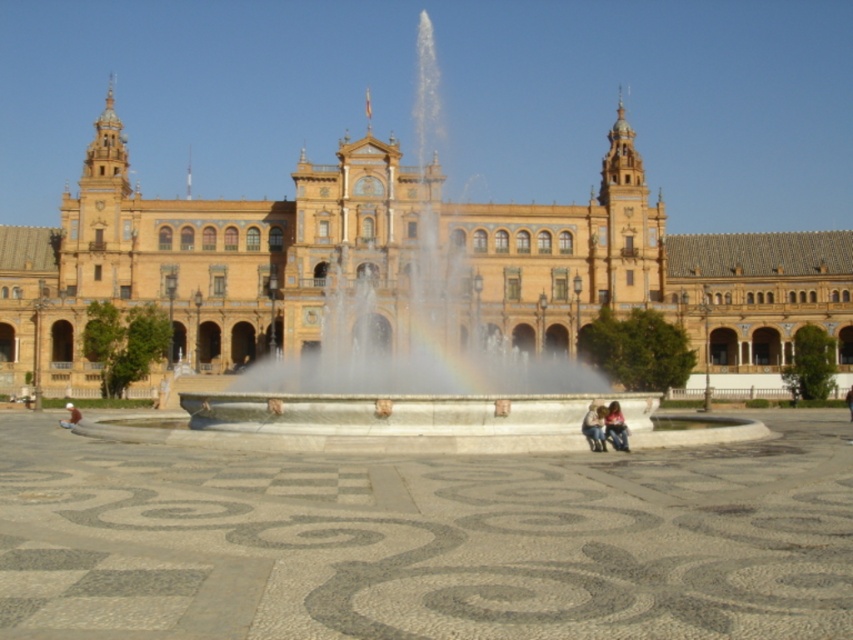
Who is more distant from viewer, [592,445] or [73,403]?

Point [73,403]

Who is more forward, [589,433] or [62,419]?

Positioned in front is point [589,433].

Where is `denim jeans at center`? The height and width of the screenshot is (640, 853). denim jeans at center is located at coordinates (595, 426).

Who is taller, denim jeans at center or light brown leather jacket at lower right?

light brown leather jacket at lower right

Who is shorter, denim jeans at center or light brown leather jacket at lower right?

Standing shorter between the two is denim jeans at center.

Where is `denim jeans at center`? denim jeans at center is located at coordinates (595, 426).

Looking at this image, is golden stone palace at center above light brown leather jacket at lower left?

Yes, golden stone palace at center is above light brown leather jacket at lower left.

Locate an element on the screen. This screenshot has height=640, width=853. golden stone palace at center is located at coordinates (200, 260).

Identify the location of golden stone palace at center. Image resolution: width=853 pixels, height=640 pixels. (200, 260).